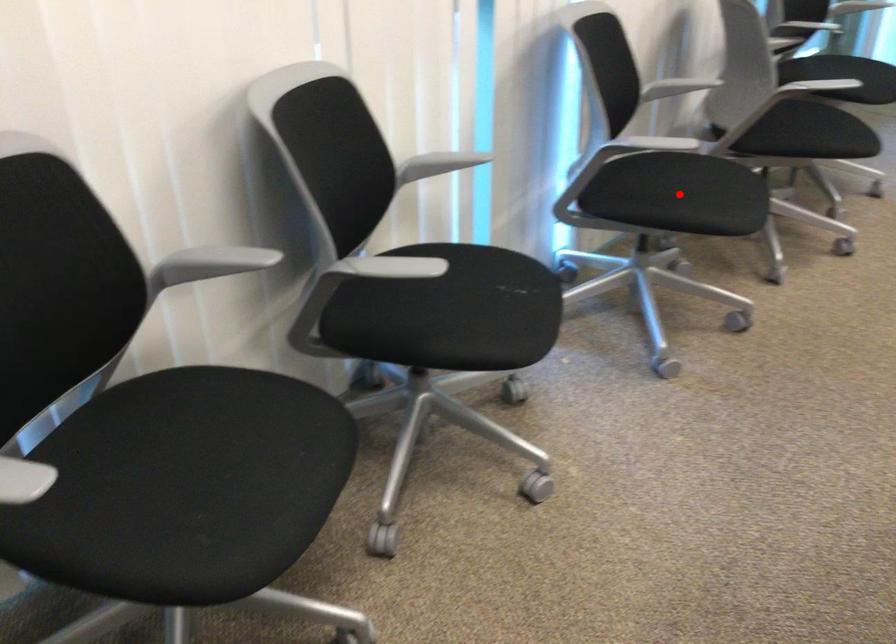
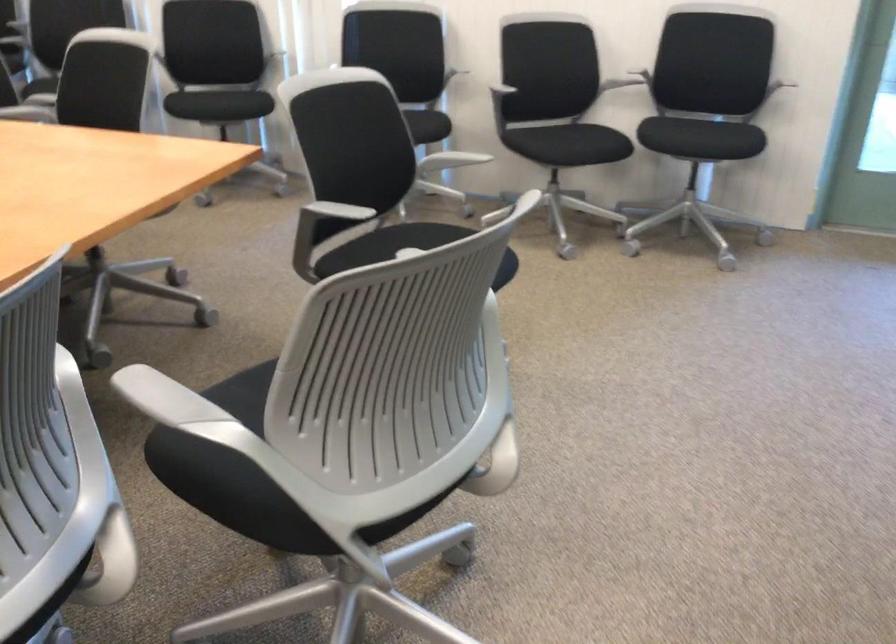
Question: I am providing you with two images of the same scene from different viewpoints. A red point is marked on the first image. At the location where the point appears in image 1, is it still visible in image 2?

Choices:
 (A) Yes
 (B) No

Answer: (B)